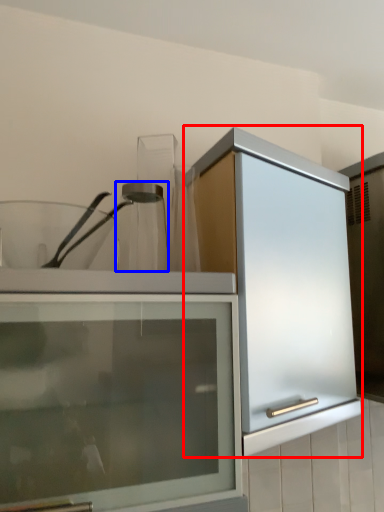
Question: Which of the following is the closest to the observer, cabinetry (highlighted by a red box) or glass jar (highlighted by a blue box)?

Choices:
 (A) cabinetry
 (B) glass jar

Answer: (A)